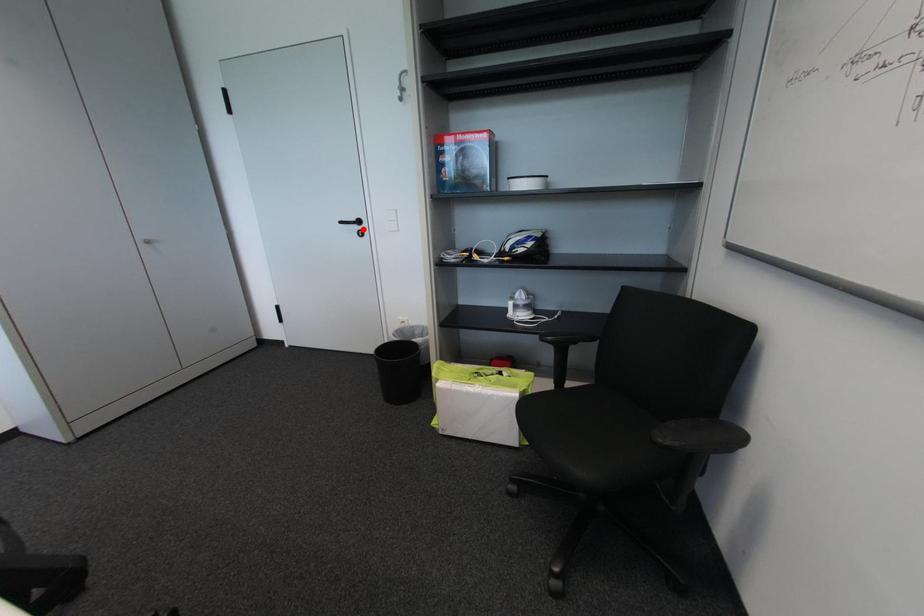
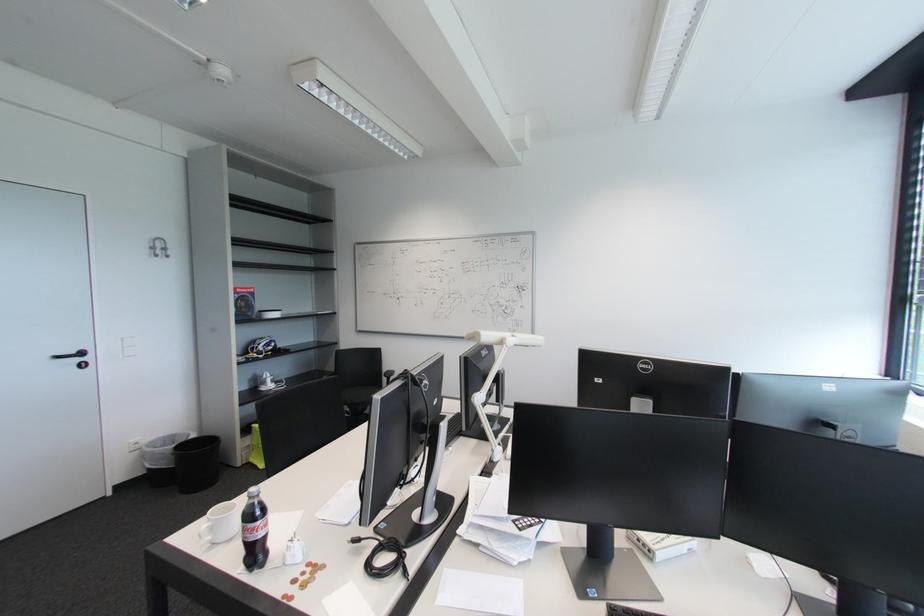
Locate, in the second image, the point that corresponds to the highlighted location in the first image.

(83, 361)